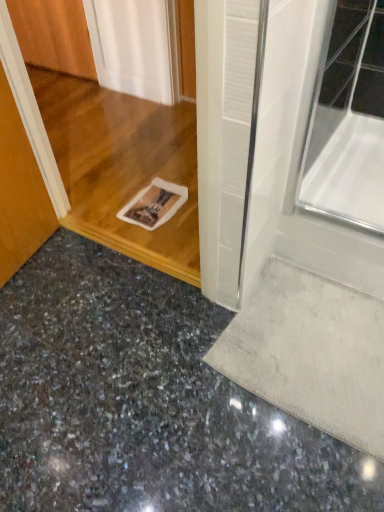
The image size is (384, 512). Find the location of `free space above white textured mat at lower right (from a real-world perspective)`. free space above white textured mat at lower right (from a real-world perspective) is located at coordinates click(x=311, y=333).